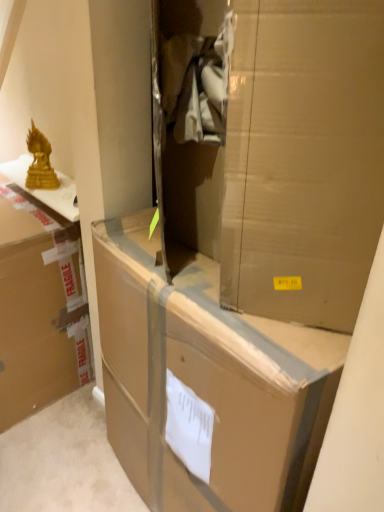
Question: From the image's perspective, relative to gold metallic statue at upper left, is brown cardboard box at left, positioned as the first box in left-to-right order, above or below?

Choices:
 (A) above
 (B) below

Answer: (B)

Question: In the image, is brown cardboard box at left, the second box when ordered from right to left, on the left side or the right side of gold metallic statue at upper left?

Choices:
 (A) left
 (B) right

Answer: (A)

Question: Based on their relative distances, which object is farther from the brown cardboard box at center?

Choices:
 (A) brown cardboard box at left, the second box when ordered from right to left
 (B) gold metallic statue at upper left
 (C) cardboard box at center, the first box from the right

Answer: (B)

Question: Based on their relative distances, which object is nearer to the gold metallic statue at upper left?

Choices:
 (A) brown cardboard box at center
 (B) brown cardboard box at left, the second box when ordered from right to left
 (C) cardboard box at center, which is counted as the second box, starting from the left

Answer: (B)